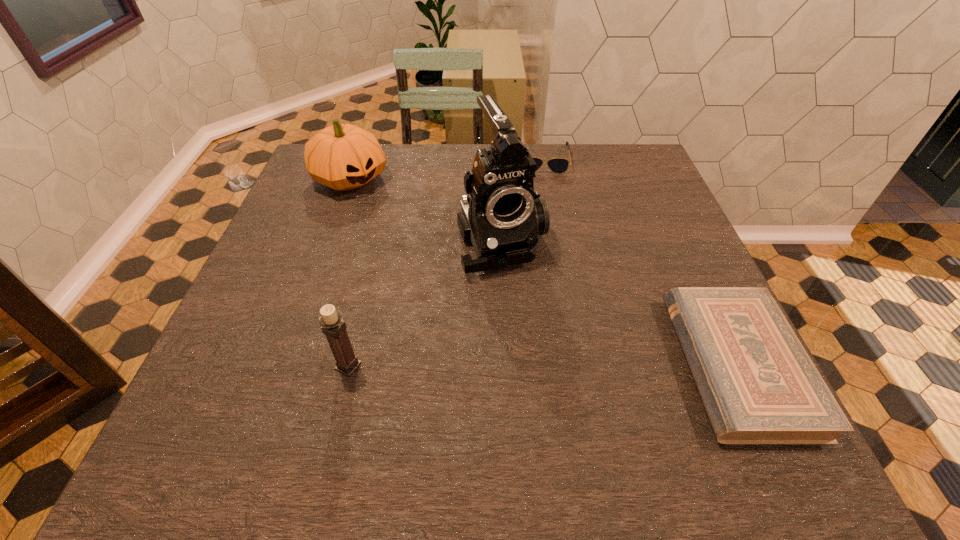
In the image, there is a desktop. In order to click on free space at the near left corner in this screenshot , I will do `click(273, 376)`.

Find the location of a particular element. Image resolution: width=960 pixels, height=540 pixels. free space at the far right corner of the desktop is located at coordinates (657, 181).

This screenshot has width=960, height=540. In order to click on free space between the rightmost object and the candle holder in this screenshot , I will do `click(543, 365)`.

In order to click on free space between the sunglasses and the rightmost object in this screenshot , I will do `click(640, 261)`.

This screenshot has height=540, width=960. In order to click on empty space between the gourd and the candle holder in this screenshot , I will do `click(349, 272)`.

Locate an element on the screen. vacant space in between the sunglasses and the gourd is located at coordinates (446, 168).

Identify the location of free space between the camcorder and the candle holder. (425, 303).

Find the location of a particular element. vacant space that's between the third nearest object and the candle holder is located at coordinates (425, 303).

You are a GUI agent. You are given a task and a screenshot of the screen. Output one action in this format:
    pyautogui.click(x=<x>, y=<y>)
    Task: Click on the empty space that is in between the sunglasses and the candle holder
    
    Given the screenshot: What is the action you would take?
    pyautogui.click(x=445, y=262)

Locate an element on the screen. The width and height of the screenshot is (960, 540). object that is the third nearest to the candle holder is located at coordinates (758, 385).